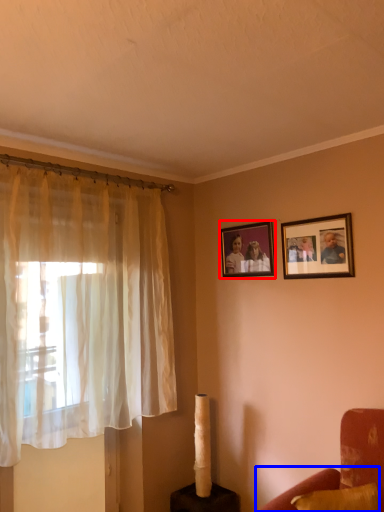
Question: Which point is further to the camera, picture frame (highlighted by a red box) or couch (highlighted by a blue box)?

Choices:
 (A) picture frame
 (B) couch

Answer: (A)